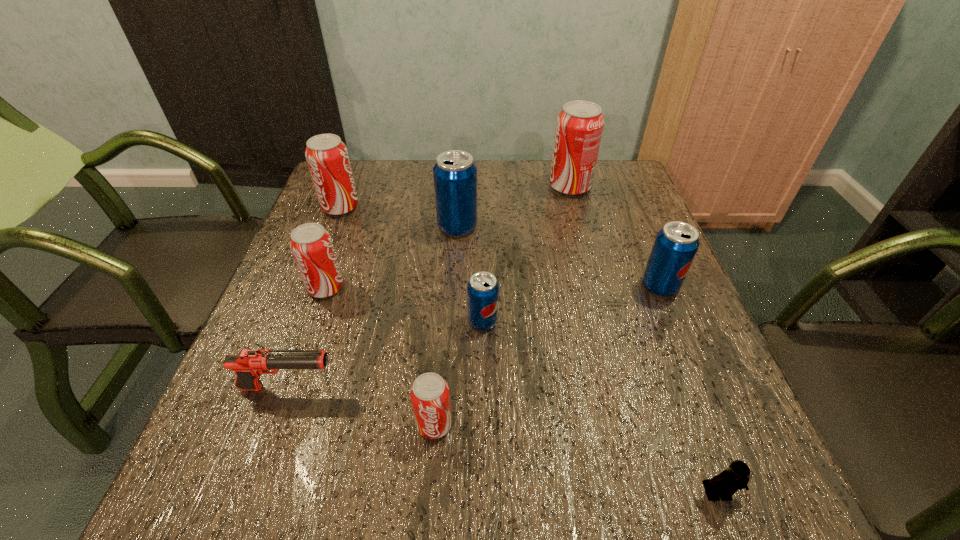
You are a GUI agent. You are given a task and a screenshot of the screen. Output one action in this format:
    pyautogui.click(x=<x>, y=<y>)
    Task: Click on the empty space that is in between the tallest soda can and the sixth farthest object
    Image resolution: width=960 pixels, height=540 pixels.
    Given the screenshot: What is the action you would take?
    pyautogui.click(x=526, y=254)

The width and height of the screenshot is (960, 540). I want to click on empty location between the biggest blue pop soda and the third farthest red soda can, so click(392, 257).

The height and width of the screenshot is (540, 960). What are the coordinates of `free space between the second soda can from right to left and the black gun` in the screenshot? It's located at click(429, 287).

Where is `vacant space in between the third smallest red soda can and the nearest blue pop soda`? vacant space in between the third smallest red soda can and the nearest blue pop soda is located at coordinates (412, 264).

In order to click on unoccupied area between the farthest blue pop soda and the nearest soda can in this screenshot , I will do `click(445, 325)`.

Locate an element on the screen. The width and height of the screenshot is (960, 540). free space between the second red soda can from right to left and the second farthest blue pop soda is located at coordinates (547, 355).

Point out which object is positioned as the third nearest to the nearest object. Please provide its 2D coordinates. Your answer should be formatted as a tuple, i.e. [(x, y)], where the tuple contains the x and y coordinates of a point satisfying the conditions above.

[(482, 289)]

Point out which object is positioned as the fourth nearest to the black gun. Please provide its 2D coordinates. Your answer should be formatted as a tuple, i.e. [(x, y)], where the tuple contains the x and y coordinates of a point satisfying the conditions above.

[(455, 174)]

Choose which soda can is the fifth nearest neighbor to the second nearest soda can. Please provide its 2D coordinates. Your answer should be formatted as a tuple, i.e. [(x, y)], where the tuple contains the x and y coordinates of a point satisfying the conditions above.

[(327, 157)]

Find the location of a particular element. This screenshot has height=540, width=960. the sixth closest soda can to the smallest blue pop soda is located at coordinates (579, 126).